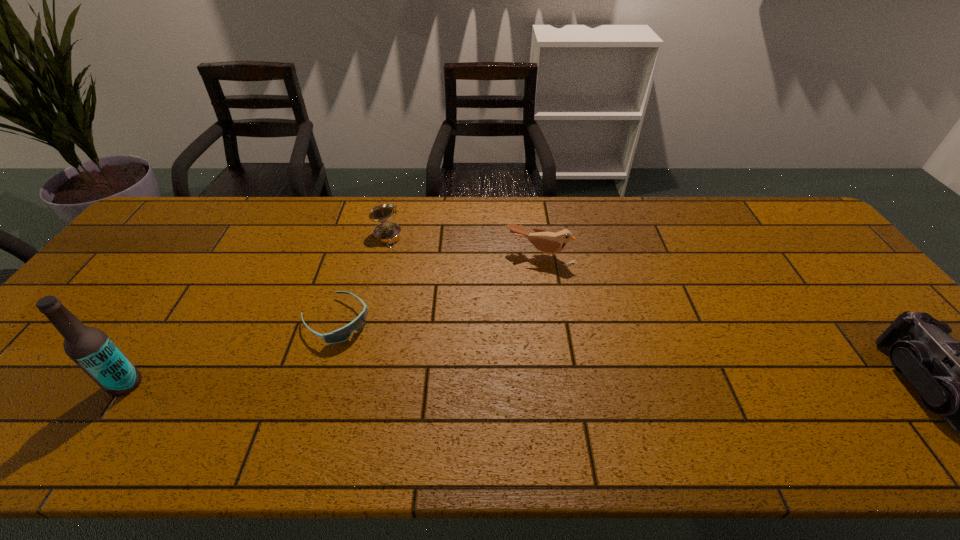
The height and width of the screenshot is (540, 960). Find the location of `beer bottle`. beer bottle is located at coordinates (91, 349).

Identify the location of the tallest object. The height and width of the screenshot is (540, 960). (91, 349).

What are the coordinates of `the second object from right to left` in the screenshot? It's located at (547, 242).

The image size is (960, 540). I want to click on the shortest object, so click(344, 333).

Where is `compass`? The width and height of the screenshot is (960, 540). compass is located at coordinates (385, 233).

You are a GUI agent. You are given a task and a screenshot of the screen. Output one action in this format:
    pyautogui.click(x=<x>, y=<y>)
    Task: Click on the vacant space located 0.250m at the beak of the second object from right to left
    Image resolution: width=960 pixels, height=540 pixels.
    Given the screenshot: What is the action you would take?
    pyautogui.click(x=501, y=328)

Locate an element on the screen. blank space located 0.290m at the beak of the second object from right to left is located at coordinates (495, 340).

This screenshot has height=540, width=960. Find the location of `vacant region located 0.300m at the beak of the second object from right to left`. vacant region located 0.300m at the beak of the second object from right to left is located at coordinates (x=494, y=342).

This screenshot has height=540, width=960. In order to click on vacant area situated 0.090m on the front-facing side of the shortest object in this screenshot , I will do `click(378, 357)`.

At what (x,y) coordinates should I click in order to perform the action: click on vacant region located 0.110m on the front-facing side of the shortest object. Please return your answer as a coordinate pair (x, y). Looking at the image, I should click on (383, 362).